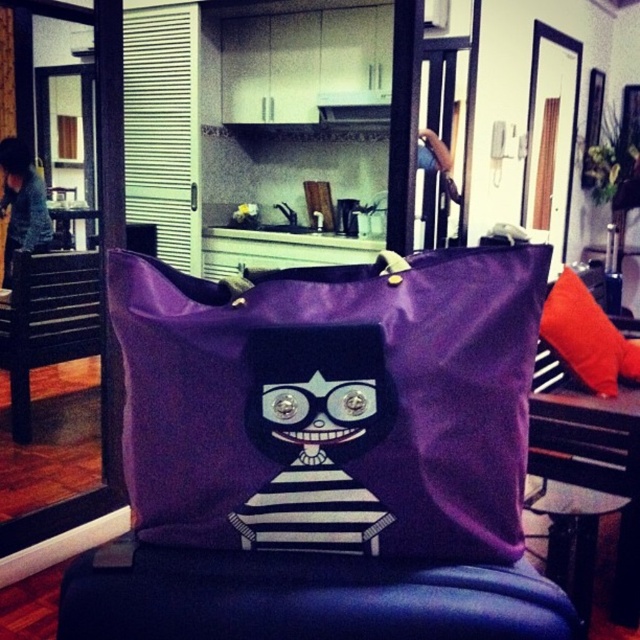
You are standing in the living room and want to place a 18 inches wide painting on the wall behind the purple fabric stool at center. Can you hang the painting there without it overlapping with the stool?

The purple fabric stool at center is 17.89 inches from the camera. Since the painting is 18 inches wide, it might overlap with the stool if placed directly behind it. Consider hanging it slightly to the side or adjusting the distance for a better fit.

You are a delivery person who needs to place a package between the purple fabric tote at center and the blue denim jacket at left. The package is 3 feet long. Is there enough space between them to fit the package?

The purple fabric tote at center is 5.23 feet from the blue denim jacket at left. Since the package is 3 feet long, there is sufficient space to place it between them.

You are organizing a small event and need to place a 1.2 meter long table between the black wood swivel chair at left and the blue denim jacket at left. Is there enough space between them to fit the table?

The black wood swivel chair at left is to the left of the blue denim jacket at left, but the distance between them isn not specified in the objects description. Therefore, we cannot determine if the table will fit.